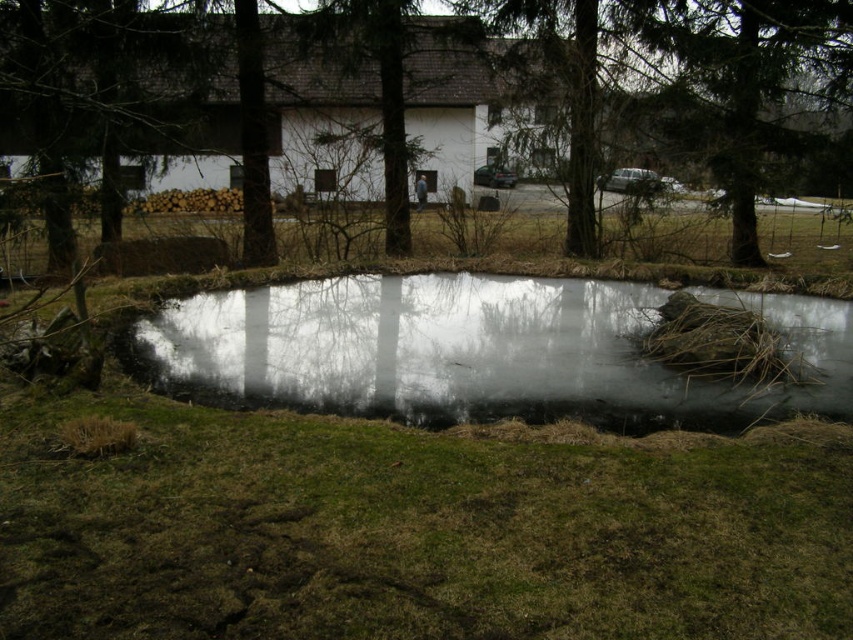
Is brown textured tree at center thinner than transparent ice at center?

No, brown textured tree at center is not thinner than transparent ice at center.

Is point (456, 61) positioned before point (252, 305)?

That is False.

Between point (714, 72) and point (320, 396), which one is positioned in front?

Positioned in front is point (320, 396).

Where is `brown textured tree at center`? Image resolution: width=853 pixels, height=640 pixels. brown textured tree at center is located at coordinates (627, 96).